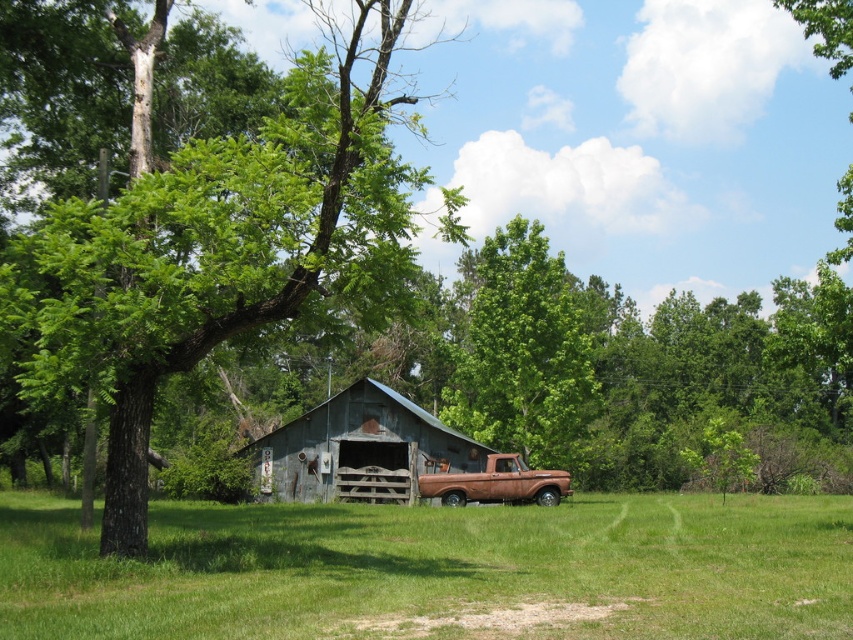
Question: Can you confirm if green leafy tree at left is thinner than rusty metal truck at center?

Choices:
 (A) yes
 (B) no

Answer: (B)

Question: Which of the following is the closest to the observer?

Choices:
 (A) (566, 472)
 (B) (296, 458)
 (C) (540, 304)

Answer: (A)

Question: Can you confirm if green leafy tree at center is thinner than rusty metal barn at center?

Choices:
 (A) no
 (B) yes

Answer: (A)

Question: Among these points, which one is nearest to the camera?

Choices:
 (A) (531, 490)
 (B) (494, 330)

Answer: (A)

Question: Estimate the real-world distances between objects in this image. Which object is farther from the rusty metal barn at center?

Choices:
 (A) rusty metal truck at center
 (B) green leafy tree at center

Answer: (B)

Question: Is green grass at lower center to the left of green leafy tree at center from the viewer's perspective?

Choices:
 (A) no
 (B) yes

Answer: (B)